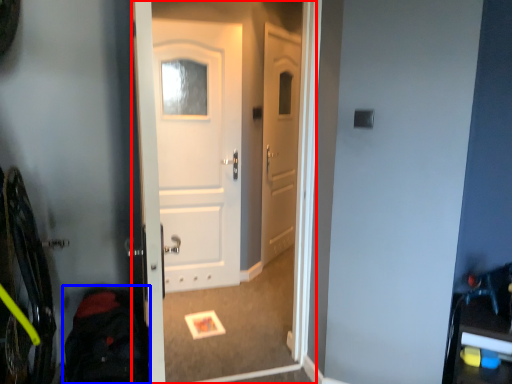
Question: Which object is closer to the camera taking this photo, screen door (highlighted by a red box) or back (highlighted by a blue box)?

Choices:
 (A) screen door
 (B) back

Answer: (B)